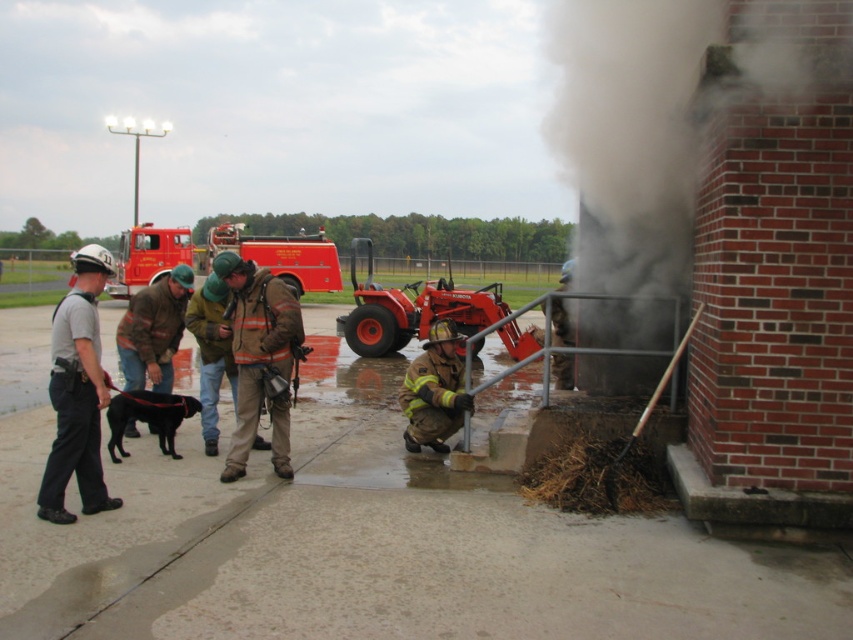
Between firefighter uniform at lower center and hard hat firefighter at lower right, which one appears on the right side from the viewer's perspective?

From the viewer's perspective, hard hat firefighter at lower right appears more on the right side.

Is point (460, 364) positioned behind point (556, 300)?

No, it is in front of (556, 300).

You are a GUI agent. You are given a task and a screenshot of the screen. Output one action in this format:
    pyautogui.click(x=<x>, y=<y>)
    Task: Click on the firefighter uniform at lower center
    This screenshot has height=640, width=853.
    Given the screenshot: What is the action you would take?
    pyautogui.click(x=434, y=390)

Is black smoke at right thinner than brown fuzzy jacket at left?

No.

Is point (578, 275) positioned after point (170, 276)?

Yes, point (578, 275) is behind point (170, 276).

The image size is (853, 640). In order to click on black smoke at right in this screenshot , I will do `click(657, 116)`.

Is point (141, 332) positioned in front of point (566, 285)?

Yes, point (141, 332) is closer to viewer.

Is brown fuzzy jacket at left to the left of hard hat firefighter at lower right from the viewer's perspective?

Correct, you'll find brown fuzzy jacket at left to the left of hard hat firefighter at lower right.

Describe the element at coordinates (154, 330) in the screenshot. I see `brown fuzzy jacket at left` at that location.

Identify the location of brown fuzzy jacket at left. Image resolution: width=853 pixels, height=640 pixels. (154, 330).